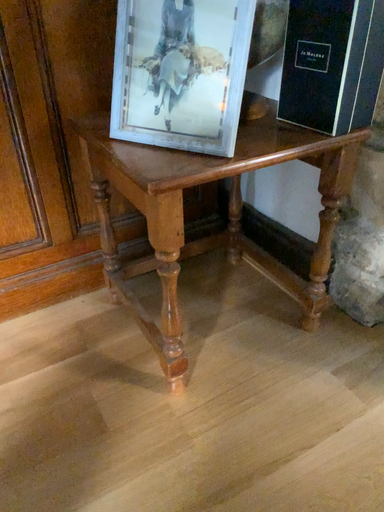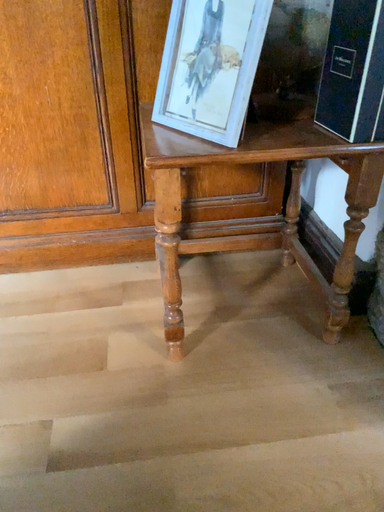
Question: Which way did the camera rotate in the video?

Choices:
 (A) rotated right
 (B) rotated left

Answer: (B)